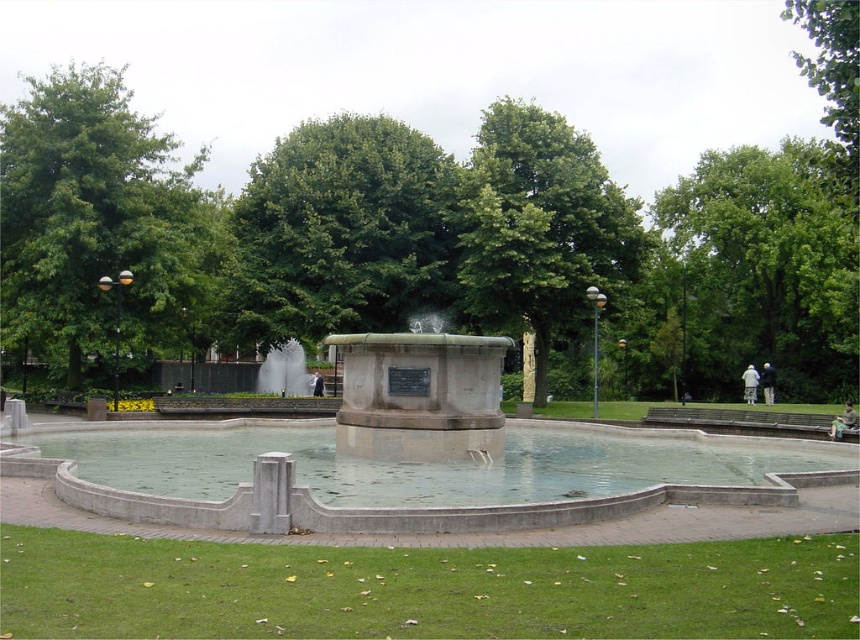
Which is more to the right, green leafy tree at upper left or green leafy tree at center?

green leafy tree at center is more to the right.

Image resolution: width=860 pixels, height=640 pixels. Describe the element at coordinates (97, 224) in the screenshot. I see `green leafy tree at upper left` at that location.

You are a GUI agent. You are given a task and a screenshot of the screen. Output one action in this format:
    pyautogui.click(x=<x>, y=<y>)
    Task: Click on the green leafy tree at upper left
    The width and height of the screenshot is (860, 640).
    Given the screenshot: What is the action you would take?
    pyautogui.click(x=97, y=224)

This screenshot has width=860, height=640. What do you see at coordinates (341, 232) in the screenshot?
I see `green leafy tree at center` at bounding box center [341, 232].

Based on the photo, can you confirm if green leafy tree at center is wider than green leafy tree at upper right?

No.

Between point (338, 301) and point (831, 99), which one is positioned in front?

Point (831, 99) is in front.

Locate an element on the screen. green leafy tree at center is located at coordinates (341, 232).

Does smooth concrete fountain at center appear over green leafy tree at upper right?

Actually, smooth concrete fountain at center is below green leafy tree at upper right.

Describe the element at coordinates (427, 477) in the screenshot. The width and height of the screenshot is (860, 640). I see `smooth concrete fountain at center` at that location.

Does point (439, 522) come behind point (800, 54)?

No, it is in front of (800, 54).

Locate an element on the screen. Image resolution: width=860 pixels, height=640 pixels. smooth concrete fountain at center is located at coordinates (427, 477).